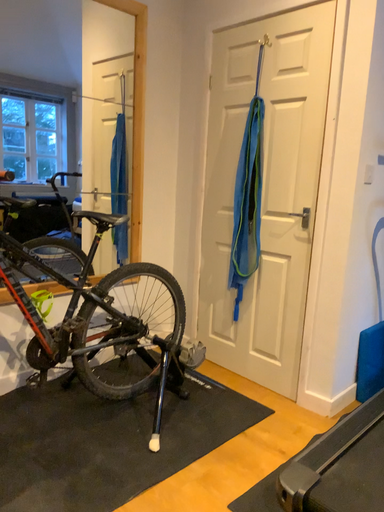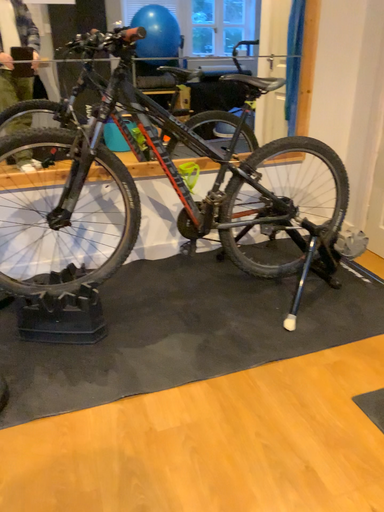
Question: How did the camera likely rotate when shooting the video?

Choices:
 (A) rotated left
 (B) rotated right

Answer: (A)